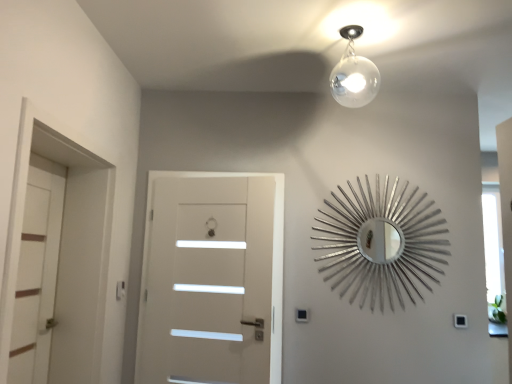
Question: Can you confirm if black plastic light switch at lower right is positioned to the left of white matte door at left, marked as the 2th door in a right-to-left arrangement?

Choices:
 (A) yes
 (B) no

Answer: (B)

Question: Can you confirm if black plastic light switch at lower right is taller than white matte door at left, marked as the 2th door in a right-to-left arrangement?

Choices:
 (A) yes
 (B) no

Answer: (B)

Question: Is black plastic light switch at lower right far from white matte door at left, marked as the 2th door in a right-to-left arrangement?

Choices:
 (A) yes
 (B) no

Answer: (A)

Question: Is black plastic light switch at lower right not inside white matte door at left, marked as the 2th door in a right-to-left arrangement?

Choices:
 (A) yes
 (B) no

Answer: (A)

Question: Is white matte door at left, marked as the 1th door in a left-to-right arrangement, surrounded by black plastic light switch at lower right?

Choices:
 (A) no
 (B) yes

Answer: (A)

Question: Is black plastic light switch at lower right in contact with white matte door at left, marked as the 2th door in a right-to-left arrangement?

Choices:
 (A) yes
 (B) no

Answer: (B)

Question: Is white matte door at center, the second door positioned from the left, not close to silver metallic sunburst mirror at upper right?

Choices:
 (A) yes
 (B) no

Answer: (B)

Question: Is white matte door at center, the second door positioned from the left, positioned beyond the bounds of silver metallic sunburst mirror at upper right?

Choices:
 (A) yes
 (B) no

Answer: (A)

Question: Is white matte door at center, the second door positioned from the left, next to silver metallic sunburst mirror at upper right and touching it?

Choices:
 (A) yes
 (B) no

Answer: (B)

Question: From the image's perspective, is white matte door at center, the second door positioned from the left, beneath silver metallic sunburst mirror at upper right?

Choices:
 (A) no
 (B) yes

Answer: (B)

Question: Does white matte door at center, the second door positioned from the left, have a smaller size compared to silver metallic sunburst mirror at upper right?

Choices:
 (A) no
 (B) yes

Answer: (A)

Question: Is white matte door at center, the second door positioned from the left, bigger than silver metallic sunburst mirror at upper right?

Choices:
 (A) yes
 (B) no

Answer: (A)

Question: Considering the relative positions of white matte door at center, which is the first door from right to left, and black plastic light switch at lower right in the image provided, is white matte door at center, which is the first door from right to left, to the left of black plastic light switch at lower right from the viewer's perspective?

Choices:
 (A) no
 (B) yes

Answer: (B)